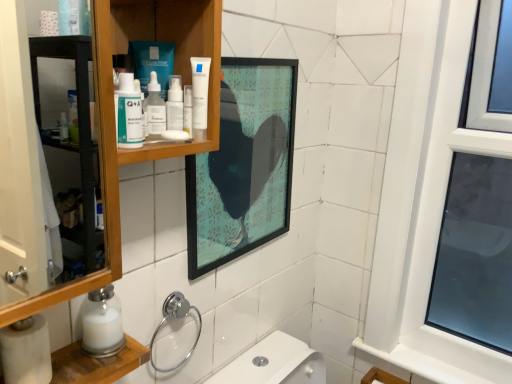
Question: Is point (197, 84) positioned closer to the camera than point (163, 307)?

Choices:
 (A) closer
 (B) farther

Answer: (A)

Question: Relative to chrome/metallic towel ring at lower center, is white matte tube at upper center in front or behind?

Choices:
 (A) behind
 (B) front

Answer: (B)

Question: Which of these objects is positioned farthest from the matte glass picture frame at upper center?

Choices:
 (A) chrome/metallic towel ring at lower center
 (B) transparent plastic bottle at upper center
 (C) wooden cabinet at upper left
 (D) white matte tube at upper center
 (E) matte plastic q+a bottle at upper left

Answer: (E)

Question: Estimate the real-world distances between objects in this image. Which object is farther from the white matte tube at upper center?

Choices:
 (A) wooden cabinet at upper left
 (B) matte glass picture frame at upper center
 (C) matte plastic q+a bottle at upper left
 (D) transparent plastic bottle at upper center
 (E) white glossy lotion at upper center

Answer: (B)